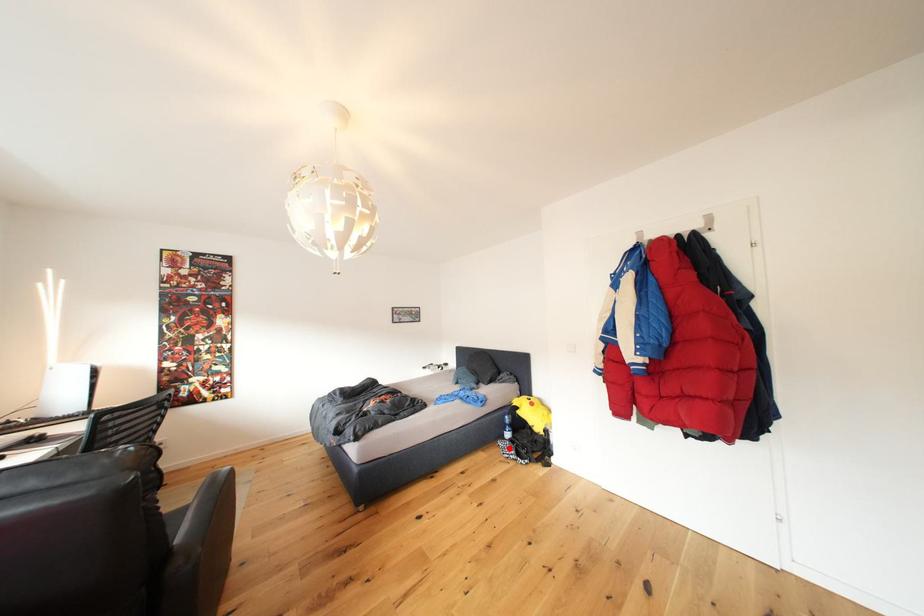
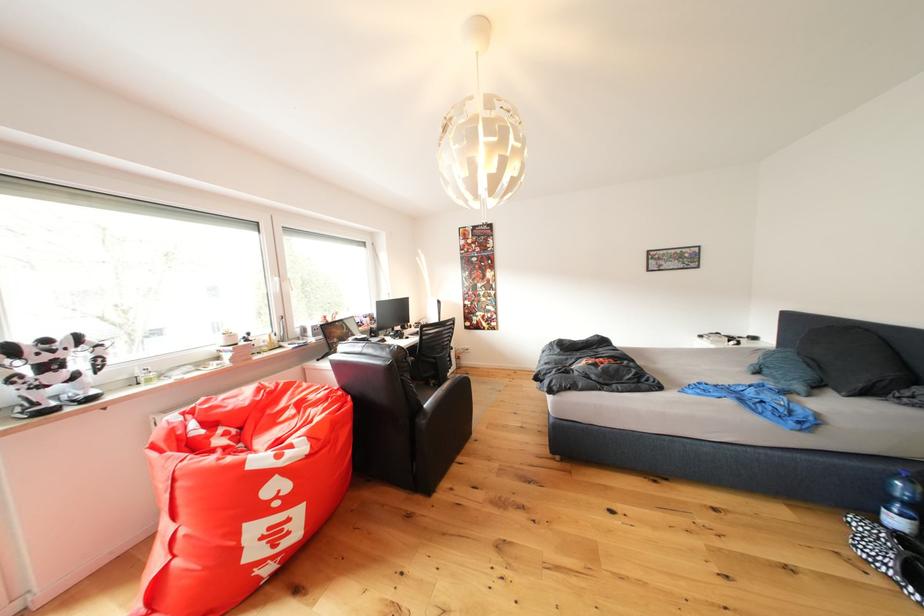
In the second image, find the point that corresponds to the highlighted location in the first image.

(864, 527)